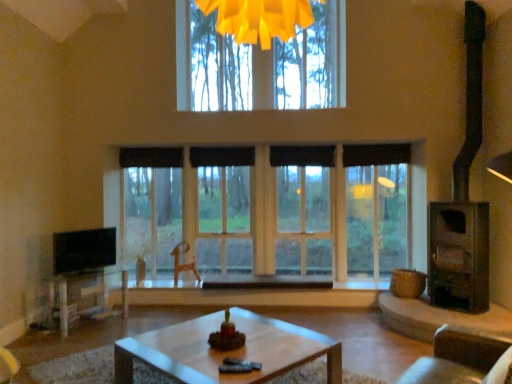
The height and width of the screenshot is (384, 512). I want to click on free spot below black glossy tv at left (from a real-world perspective), so click(80, 269).